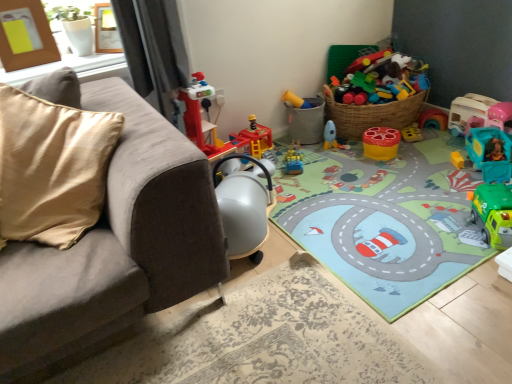
At what (x,y) coordinates should I click in order to perform the action: click on vacant space to the right of yellow matte stool at center, placed as the fourth toy when sorted from right to left. Please return your answer as a coordinate pair (x, y). The height and width of the screenshot is (384, 512). Looking at the image, I should click on (419, 147).